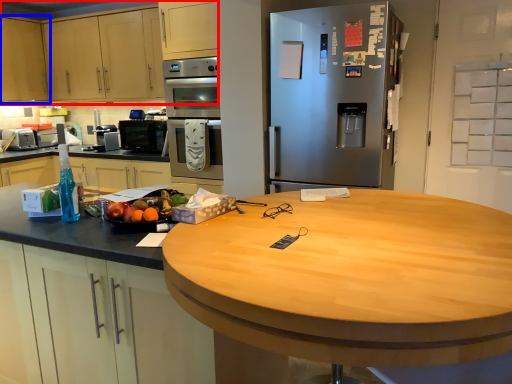
Question: Which of the following is the farthest to the observer, cabinetry (highlighted by a red box) or cabinetry (highlighted by a blue box)?

Choices:
 (A) cabinetry
 (B) cabinetry

Answer: (B)